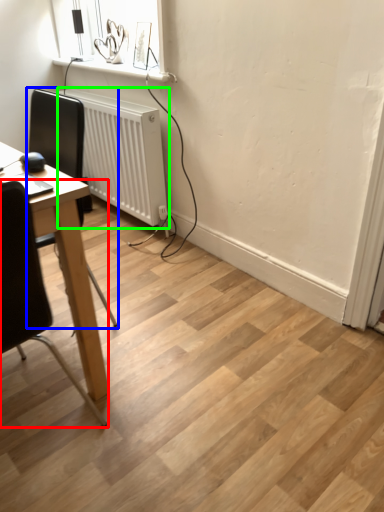
Question: Which object is positioned farthest from chair (highlighted by a red box)? Select from chair (highlighted by a blue box) and radiator (highlighted by a green box).

Choices:
 (A) chair
 (B) radiator

Answer: (A)